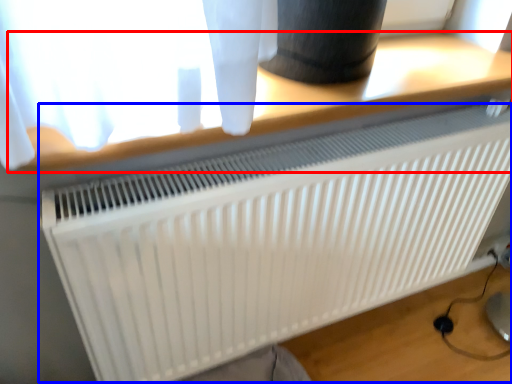
Question: Which point is closer to the camera, table (highlighted by a red box) or radiator (highlighted by a blue box)?

Choices:
 (A) table
 (B) radiator

Answer: (A)